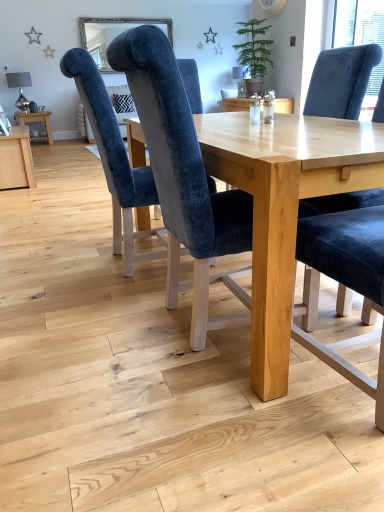
Locate an element on the screen. vacant space to the left of velvet blue chair at center, acting as the 1th chair starting from the left is located at coordinates (49, 270).